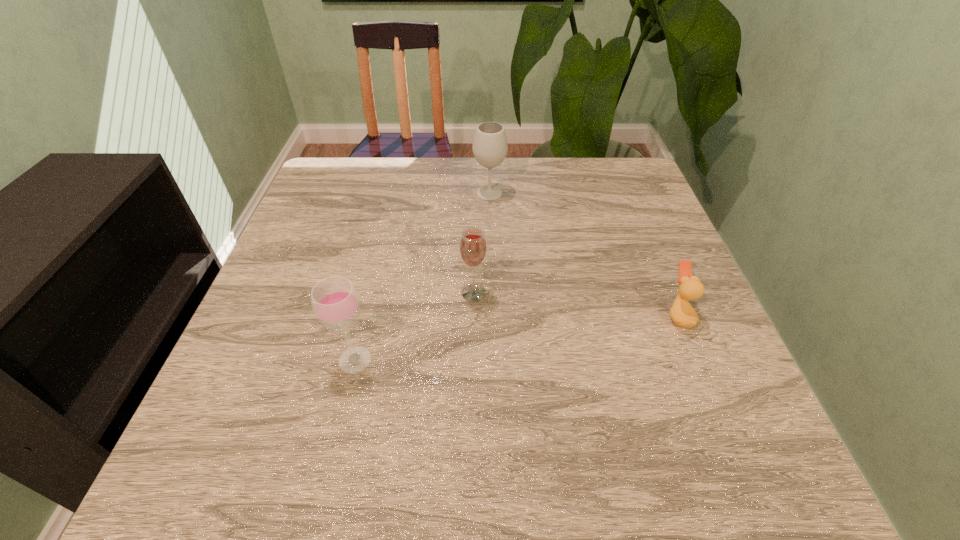
At what (x,y) coordinates should I click in order to perform the action: click on free space between the leftmost object and the second nearest wineglass. Please return your answer as a coordinate pair (x, y). Image resolution: width=960 pixels, height=540 pixels. Looking at the image, I should click on (415, 326).

Image resolution: width=960 pixels, height=540 pixels. What are the coordinates of `vacant space that's between the nearest wineglass and the farthest object` in the screenshot? It's located at (422, 276).

Identify the location of vacant area between the nearest object and the second farthest wineglass. (415, 326).

Identify the location of free space between the second nearest wineglass and the shortest object. (576, 304).

Where is `free spot between the farthest object and the leftmost wineglass`? free spot between the farthest object and the leftmost wineglass is located at coordinates (422, 276).

Locate an element on the screen. The width and height of the screenshot is (960, 540). free space between the second nearest wineglass and the leftmost object is located at coordinates (415, 326).

You are a GUI agent. You are given a task and a screenshot of the screen. Output one action in this format:
    pyautogui.click(x=<x>, y=<y>)
    Task: Click on the empty location between the rightmost object and the nearest object
    
    Given the screenshot: What is the action you would take?
    pyautogui.click(x=516, y=338)

Find the location of a particular element. free area in between the nearest wineglass and the farthest object is located at coordinates (422, 276).

Locate an element on the screen. free point between the nearest wineglass and the farthest wineglass is located at coordinates [x=422, y=276].

Locate an element on the screen. This screenshot has height=540, width=960. the third closest object to the leftmost wineglass is located at coordinates (682, 313).